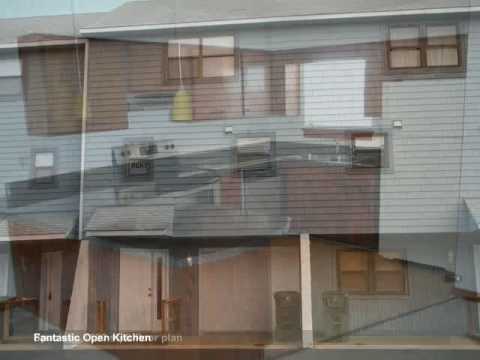
At what (x,y) coordinates should I click in order to perform the action: click on doors appearing in the glare. Please return your answer as a coordinate pair (x, y). Looking at the image, I should click on (136, 301), (128, 274), (50, 289), (53, 270).